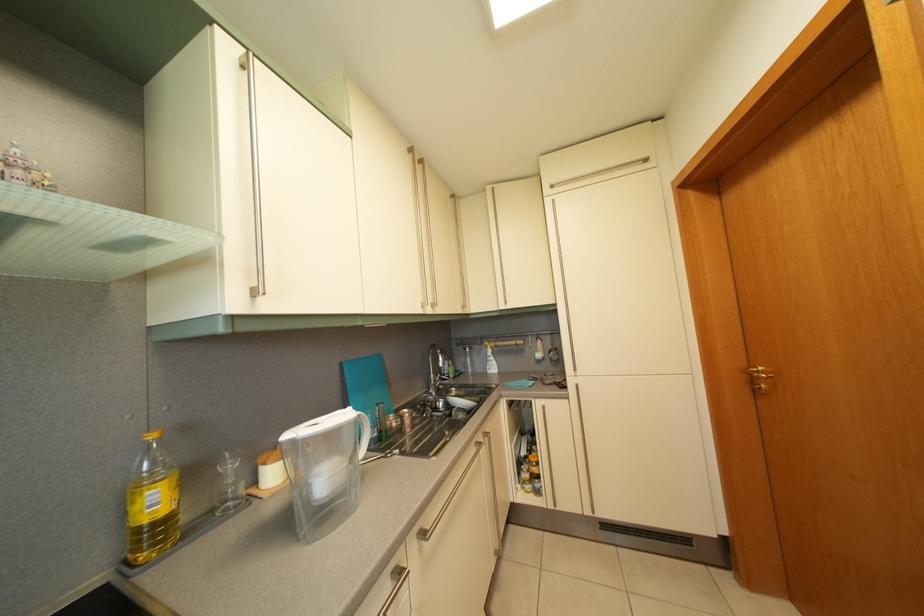
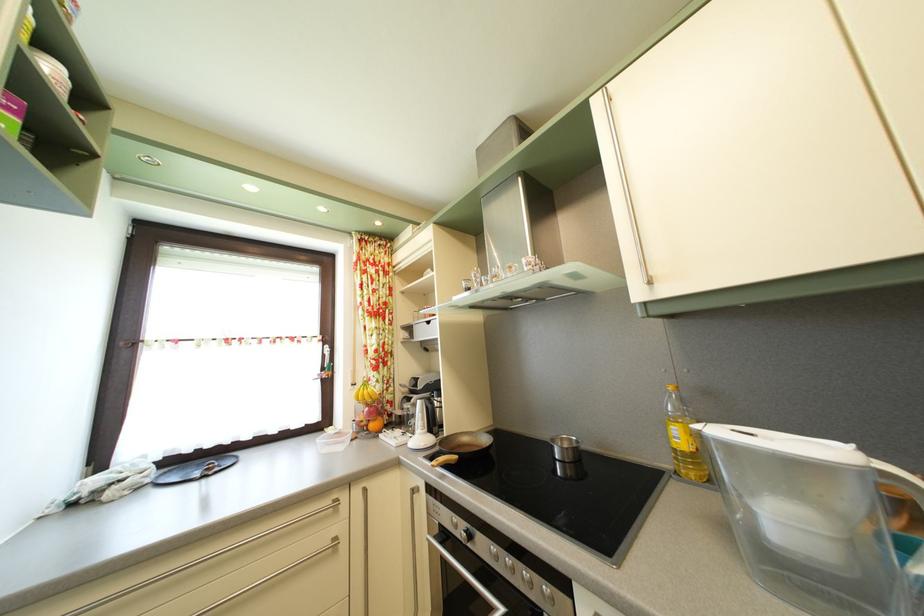
Where in the second image is the point corresponding to (161,444) from the first image?

(678, 395)